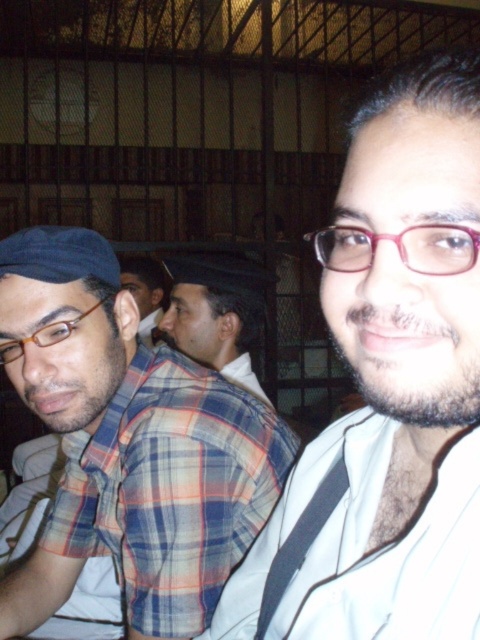
Question: Is plaid fabric shirt at left to the right of matte brown glasses at left from the viewer's perspective?

Choices:
 (A) no
 (B) yes

Answer: (B)

Question: Which object appears farthest from the camera in this image?

Choices:
 (A) white matte shirt at center
 (B) matte brown glasses at left
 (C) plaid shirt at center
 (D) pink plastic glasses at center

Answer: (C)

Question: Does plaid fabric shirt at left have a smaller size compared to plaid shirt at center?

Choices:
 (A) yes
 (B) no

Answer: (A)

Question: Which point is farther from the camera taking this photo?

Choices:
 (A) (456, 144)
 (B) (215, 298)
 (C) (131, 259)

Answer: (C)

Question: Can you confirm if pink plastic glasses at center is positioned below plaid shirt at center?

Choices:
 (A) yes
 (B) no

Answer: (A)

Question: Which object appears closest to the camera in this image?

Choices:
 (A) pink plastic glasses at center
 (B) matte brown glasses at left
 (C) plaid shirt at center
 (D) plaid fabric shirt at left

Answer: (A)